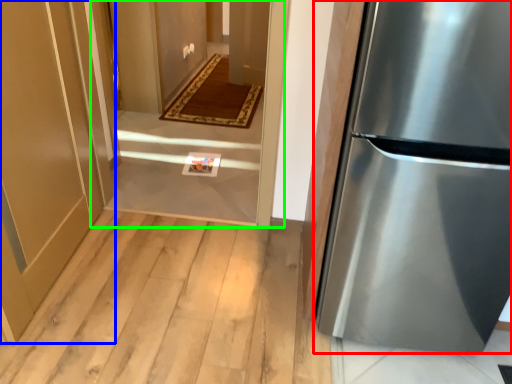
Question: Based on their relative distances, which object is farther from refrigerator (highlighted by a red box)? Choose from door (highlighted by a blue box) and corridor (highlighted by a green box).

Choices:
 (A) door
 (B) corridor

Answer: (A)